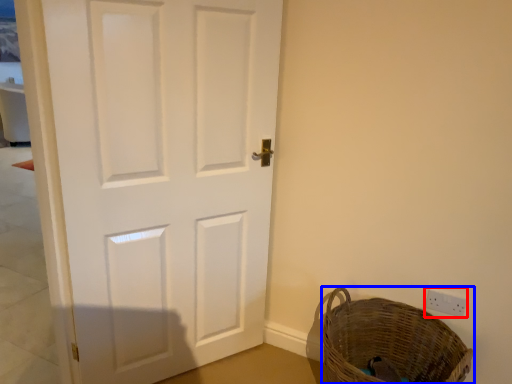
Question: Among these objects, which one is farthest to the camera, electric outlet (highlighted by a red box) or basket (highlighted by a blue box)?

Choices:
 (A) electric outlet
 (B) basket

Answer: (A)